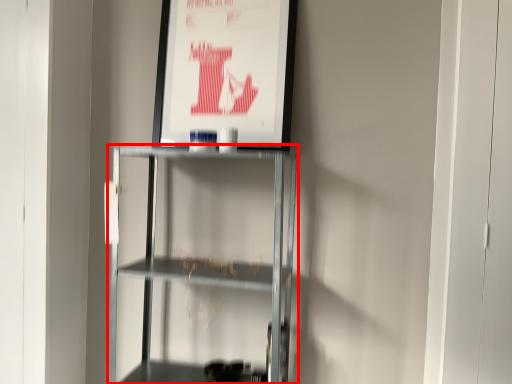
Question: Considering the relative positions of shelf (annotated by the red box) and poster page in the image provided, where is shelf (annotated by the red box) located with respect to the staircase?

Choices:
 (A) left
 (B) right

Answer: (A)